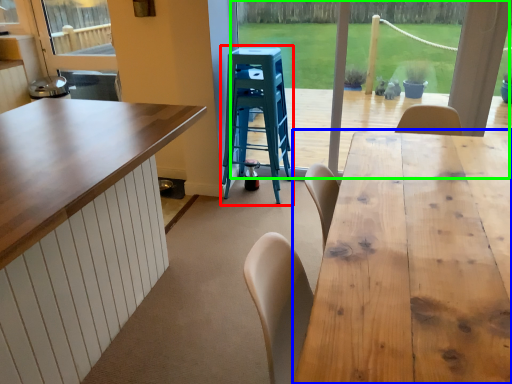
Question: Which is nearer to the step stool (highlighted by a red box)? table (highlighted by a blue box) or window frame (highlighted by a green box).

Choices:
 (A) table
 (B) window frame

Answer: (A)